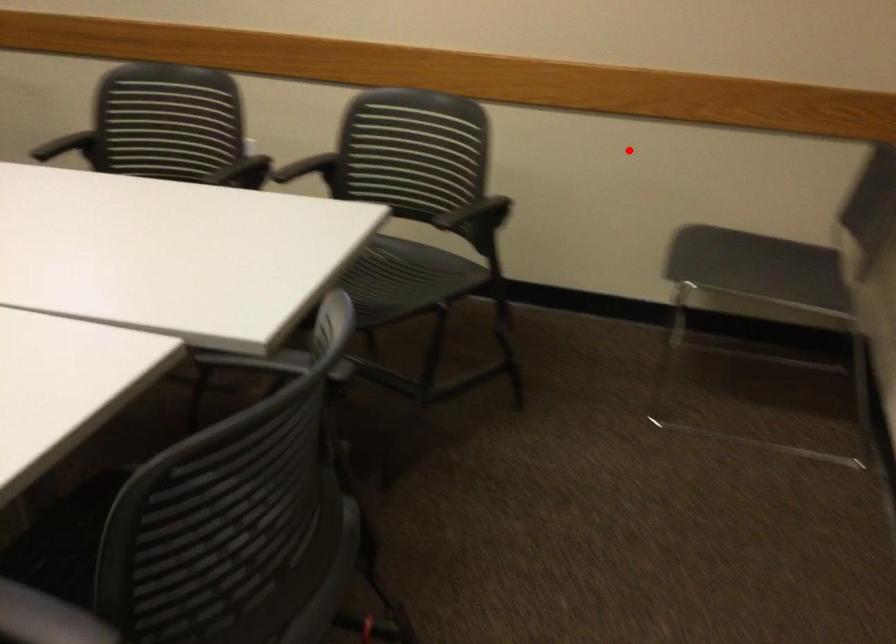
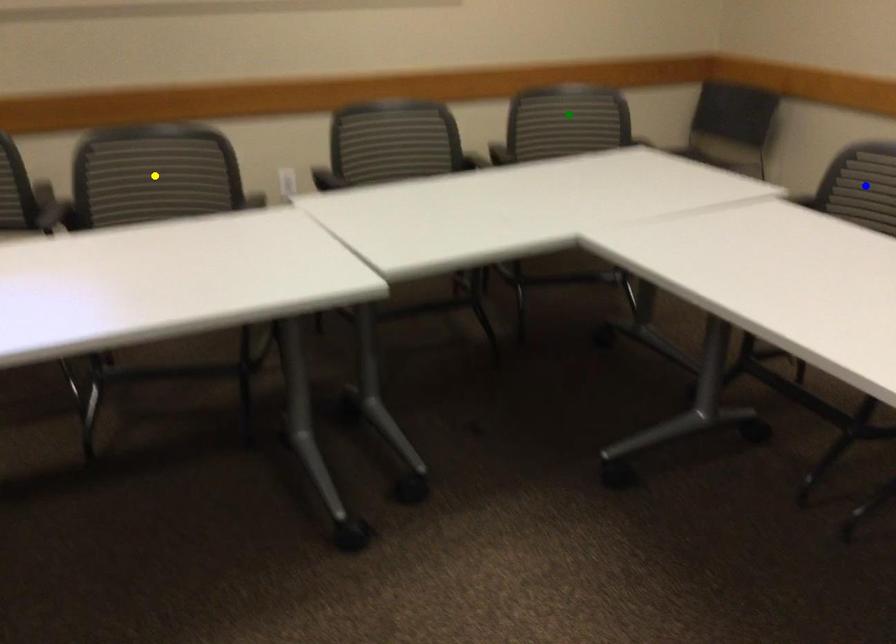
Question: I am providing you with two images of the same scene from different viewpoints. A red point is marked on the first image. You are given multiple points on the second image. Which point in image 2 represents the same 3d spot as the red point in image 1?

Choices:
 (A) green point
 (B) blue point
 (C) yellow point

Answer: (A)